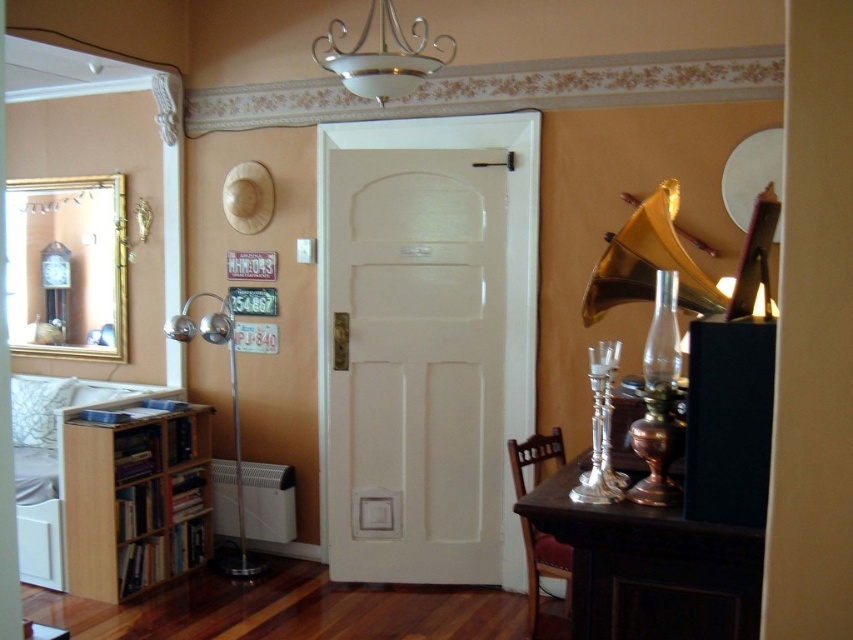
Question: Considering the real-world distances, which object is closest to the dark wood table at right?

Choices:
 (A) white painted wood door at center
 (B) light brown wood bookshelf at left
 (C) satin silver floor lamp at left
 (D) metallic chandelier at upper center

Answer: (D)

Question: Which object is the farthest from the dark wood table at right?

Choices:
 (A) white painted wood door at center
 (B) satin silver floor lamp at left
 (C) metallic chandelier at upper center
 (D) light brown wood bookshelf at left

Answer: (D)

Question: Is metallic chandelier at upper center thinner than satin silver floor lamp at left?

Choices:
 (A) yes
 (B) no

Answer: (B)

Question: Which object is closer to the camera taking this photo?

Choices:
 (A) dark wood table at right
 (B) light brown wood bookshelf at left
 (C) white painted wood door at center
 (D) metallic chandelier at upper center

Answer: (A)

Question: Can you confirm if white painted wood door at center is positioned above light brown wood bookshelf at left?

Choices:
 (A) no
 (B) yes

Answer: (B)

Question: Does dark wood table at right appear over metallic chandelier at upper center?

Choices:
 (A) yes
 (B) no

Answer: (B)